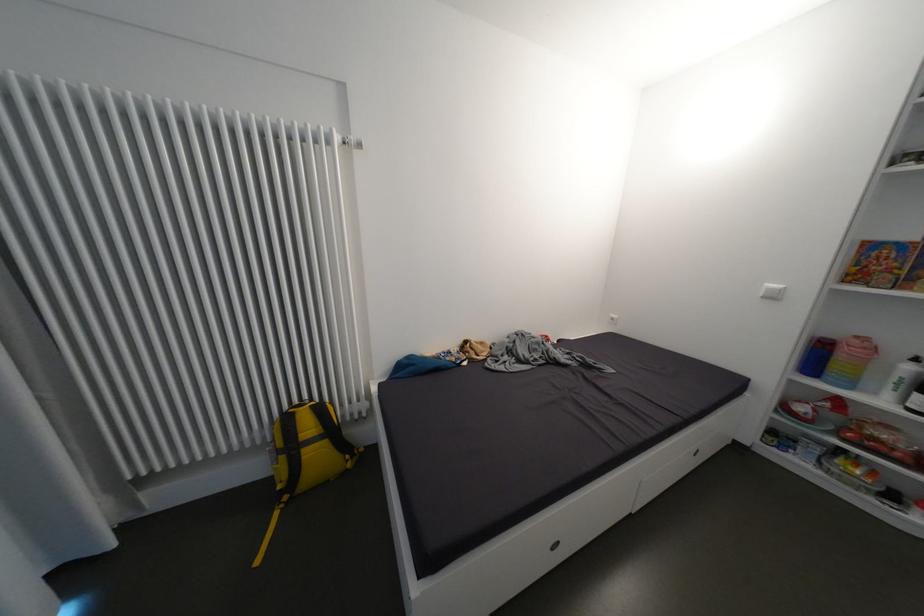
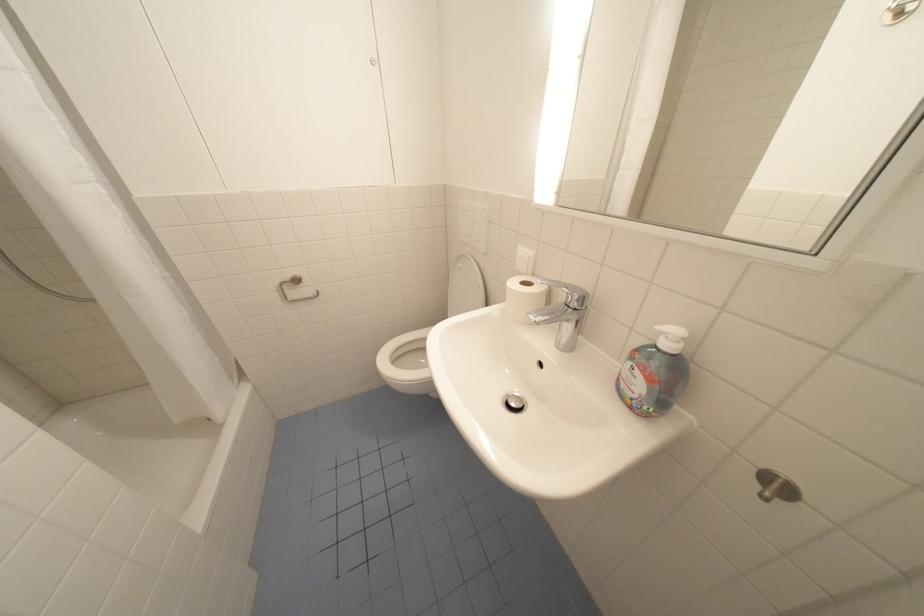
What movement of the cameraman would produce the second image?

The cameraman walked toward right, forward.